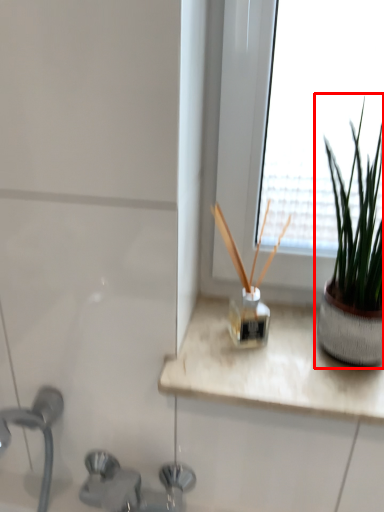
Question: Considering the relative positions of houseplant (annotated by the red box) and sink in the image provided, where is houseplant (annotated by the red box) located with respect to the staircase?

Choices:
 (A) left
 (B) right

Answer: (B)